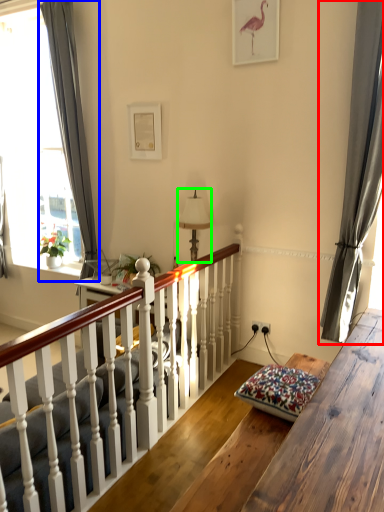
Question: Which object is positioned closest to curtain (highlighted by a red box)? Select from curtain (highlighted by a blue box) and lamp (highlighted by a green box).

Choices:
 (A) curtain
 (B) lamp

Answer: (B)